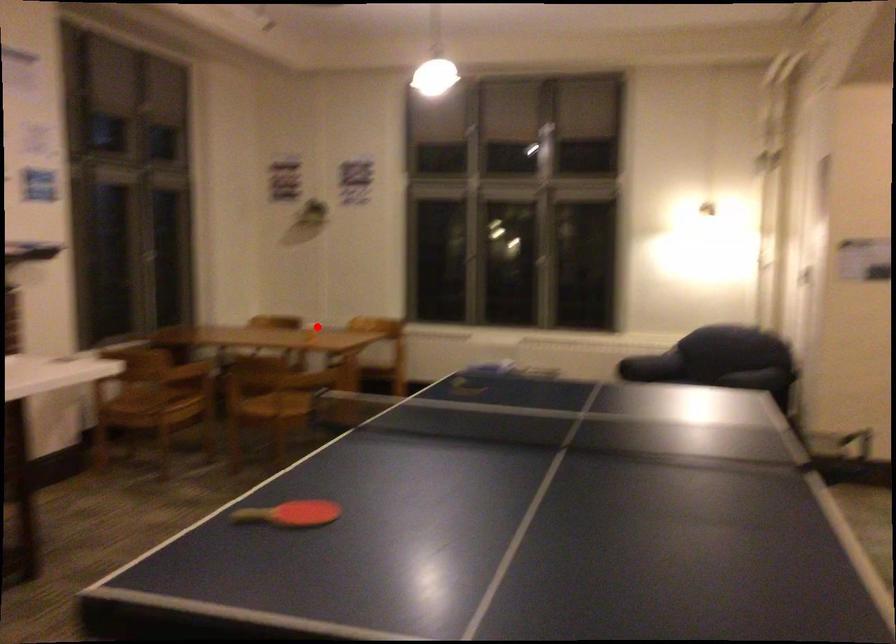
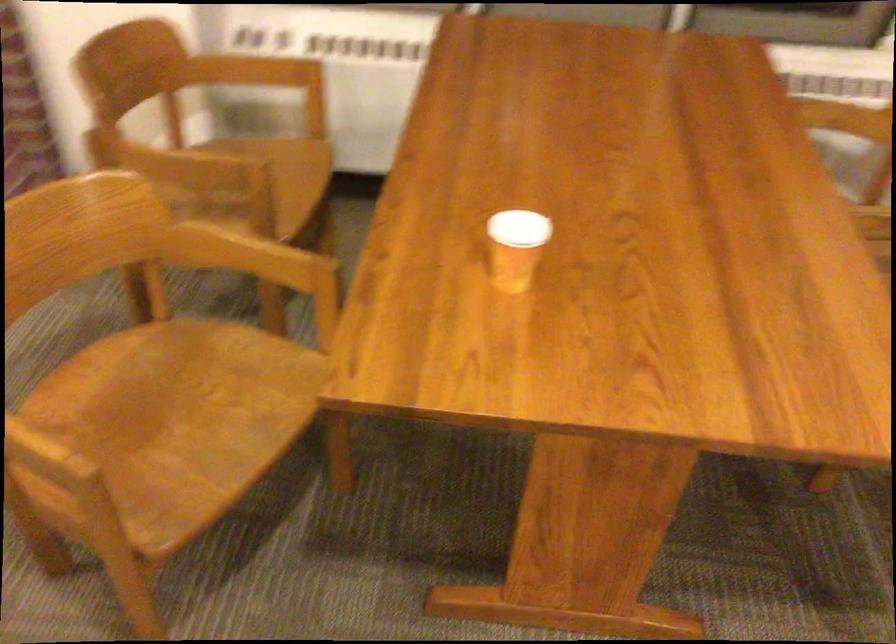
Question: I am providing you with two images of the same scene from different viewpoints. A red point is marked on the first image. At the location where the point appears in image 1, is it still visible in image 2?

Choices:
 (A) Yes
 (B) No

Answer: (A)